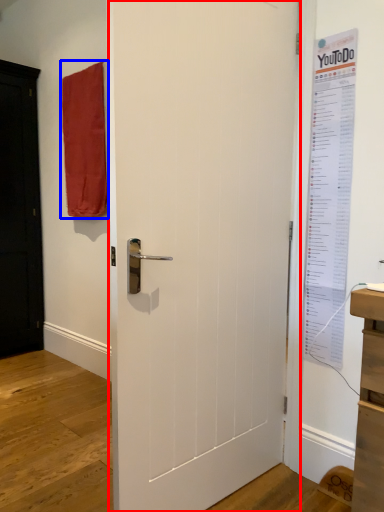
Question: Which object is further to the camera taking this photo, door (highlighted by a red box) or curtain (highlighted by a blue box)?

Choices:
 (A) door
 (B) curtain

Answer: (B)